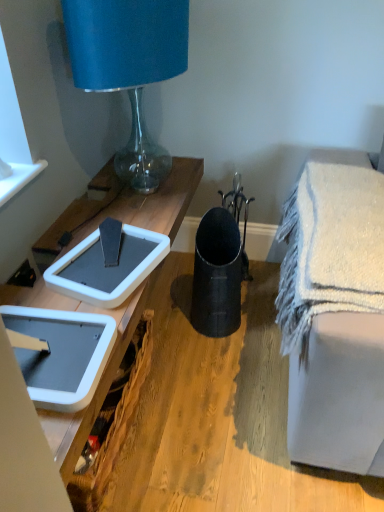
The width and height of the screenshot is (384, 512). I want to click on blue fabric lampshade at upper left, so click(129, 66).

I want to click on white plastic picnic basket at lower left, so pyautogui.click(x=113, y=421).

Measure the distance between point (x=311, y=184) and camera.

The distance of point (x=311, y=184) from camera is 1.47 meters.

Locate an element on the screen. white textured bath towel at lower right is located at coordinates (330, 244).

Consider the image. In order to face matte black vase at center, should I rotate leftwards or rightwards?

Rotate your view right by about 6.606°.

This screenshot has width=384, height=512. I want to click on blue fabric lampshade at upper left, so click(x=129, y=66).

Where is `wood below the white textured bath towel at lower right (from a real-world perspective)`? wood below the white textured bath towel at lower right (from a real-world perspective) is located at coordinates (210, 417).

Is matte black vase at center with white textured bath towel at lower right?

There is a gap between matte black vase at center and white textured bath towel at lower right.

Can you confirm if matte black vase at center is shorter than white textured bath towel at lower right?

Correct, matte black vase at center is not as tall as white textured bath towel at lower right.

Consider the image. Is white plastic picnic basket at lower left turned away from blue fabric lampshade at upper left?

That's not correct — white plastic picnic basket at lower left is not looking away from blue fabric lampshade at upper left.

Does white plastic picnic basket at lower left touch blue fabric lampshade at upper left?

No, white plastic picnic basket at lower left is not in contact with blue fabric lampshade at upper left.

Is white plastic picnic basket at lower left positioned in front of blue fabric lampshade at upper left?

Yes, the depth of white plastic picnic basket at lower left is less than that of blue fabric lampshade at upper left.

From a real-world perspective, is white plastic picnic basket at lower left above or below blue fabric lampshade at upper left?

From a real-world perspective, white plastic picnic basket at lower left is physically below blue fabric lampshade at upper left.

Is blue fabric lampshade at upper left far away from white plastic picnic basket at lower left?

Yes, blue fabric lampshade at upper left and white plastic picnic basket at lower left are located far from each other.

Considering the positions of objects blue fabric lampshade at upper left and white plastic picnic basket at lower left in the image provided, who is behind, blue fabric lampshade at upper left or white plastic picnic basket at lower left?

blue fabric lampshade at upper left is more distant.

From the image's perspective, is blue fabric lampshade at upper left on white plastic picnic basket at lower left?

Yes, from the image's perspective, blue fabric lampshade at upper left is above white plastic picnic basket at lower left.

Can white plastic picnic basket at lower left be found inside blue fabric lampshade at upper left?

Definitely not — white plastic picnic basket at lower left is not inside blue fabric lampshade at upper left.

Is matte black vase at center situated inside white plastic picnic basket at lower left or outside?

matte black vase at center exists outside the volume of white plastic picnic basket at lower left.

What's the angular difference between matte black vase at center and white plastic picnic basket at lower left's facing directions?

matte black vase at center and white plastic picnic basket at lower left are facing 1.98 degrees away from each other.

Is matte black vase at center further to camera compared to white plastic picnic basket at lower left?

Yes, it is.

Is matte black vase at center shorter than white plastic picnic basket at lower left?

Indeed, matte black vase at center has a lesser height compared to white plastic picnic basket at lower left.

Is white plastic picnic basket at lower left aimed at matte black vase at center?

Yes, white plastic picnic basket at lower left is turned towards matte black vase at center.

Can you confirm if white plastic picnic basket at lower left is positioned to the left of matte black vase at center?

Correct, you'll find white plastic picnic basket at lower left to the left of matte black vase at center.

Identify the location of wood that is above the white plastic picnic basket at lower left (from the image's perspective). (210, 417).

Is point (325, 227) closer to viewer compared to point (214, 437)?

That is True.

From a real-world perspective, who is located lower, white textured bath towel at lower right or matte black vase at center?

matte black vase at center, from a real-world perspective.

In the image, is white textured bath towel at lower right on the left side or the right side of matte black vase at center?

Clearly, white textured bath towel at lower right is on the right of matte black vase at center in the image.

Considering the positions of point (282, 273) and point (96, 499), is point (282, 273) closer or farther from the camera than point (96, 499)?

Point (282, 273).

Looking at this image, which of these two, white textured bath towel at lower right or white plastic picnic basket at lower left, is wider?

white textured bath towel at lower right.

How distant is white textured bath towel at lower right from white plastic picnic basket at lower left?

white textured bath towel at lower right and white plastic picnic basket at lower left are 26.05 inches apart from each other.

Can you confirm if white textured bath towel at lower right is bigger than white plastic picnic basket at lower left?

Yes.

The width and height of the screenshot is (384, 512). What are the coordinates of `bath towel in front of the matte black vase at center` in the screenshot? It's located at (330, 244).

Locate an element on the screen. Image resolution: width=384 pixels, height=512 pixels. picnic basket below the blue fabric lampshade at upper left (from a real-world perspective) is located at coordinates (113, 421).

Considering their positions, is white textured bath towel at lower right positioned further to white plastic picnic basket at lower left than blue fabric lampshade at upper left?

blue fabric lampshade at upper left is positioned further to the anchor white plastic picnic basket at lower left.

Based on their spatial positions, is white textured bath towel at lower right or matte black vase at center further from white plastic picnic basket at lower left?

→ white textured bath towel at lower right lies further to white plastic picnic basket at lower left than the other object.

From the image, which object appears to be nearer to white textured bath towel at lower right, white plastic picnic basket at lower left or blue fabric lampshade at upper left?

The object closer to white textured bath towel at lower right is white plastic picnic basket at lower left.

Based on their spatial positions, is white plastic picnic basket at lower left or white textured bath towel at lower right closer to matte black vase at center?

white plastic picnic basket at lower left lies closer to matte black vase at center than the other object.

Which object lies further to the anchor point blue fabric lampshade at upper left, matte black vase at center or white textured bath towel at lower right?

Based on the image, matte black vase at center appears to be further to blue fabric lampshade at upper left.

Estimate the real-world distances between objects in this image. Which object is closer to white textured bath towel at lower right, blue fabric lampshade at upper left or white plastic picnic basket at lower left?

Among the two, white plastic picnic basket at lower left is located nearer to white textured bath towel at lower right.

When comparing their distances from matte black vase at center, does blue fabric lampshade at upper left or white textured bath towel at lower right seem closer?

Based on the image, white textured bath towel at lower right appears to be nearer to matte black vase at center.

From the image, which object appears to be farther from matte black vase at center, blue fabric lampshade at upper left or white plastic picnic basket at lower left?

Among the two, blue fabric lampshade at upper left is located further to matte black vase at center.

Locate an element on the screen. bath towel that lies between blue fabric lampshade at upper left and white plastic picnic basket at lower left from top to bottom is located at coordinates (330, 244).

Find the location of a particular element. This screenshot has width=384, height=512. wood between white plastic picnic basket at lower left and white textured bath towel at lower right in the horizontal direction is located at coordinates (210, 417).

This screenshot has width=384, height=512. What are the coordinates of `bath towel between blue fabric lampshade at upper left and matte black vase at center from top to bottom` in the screenshot? It's located at (330, 244).

Find the location of a particular element. This screenshot has width=384, height=512. wood between blue fabric lampshade at upper left and white plastic picnic basket at lower left in the up-down direction is located at coordinates (210, 417).